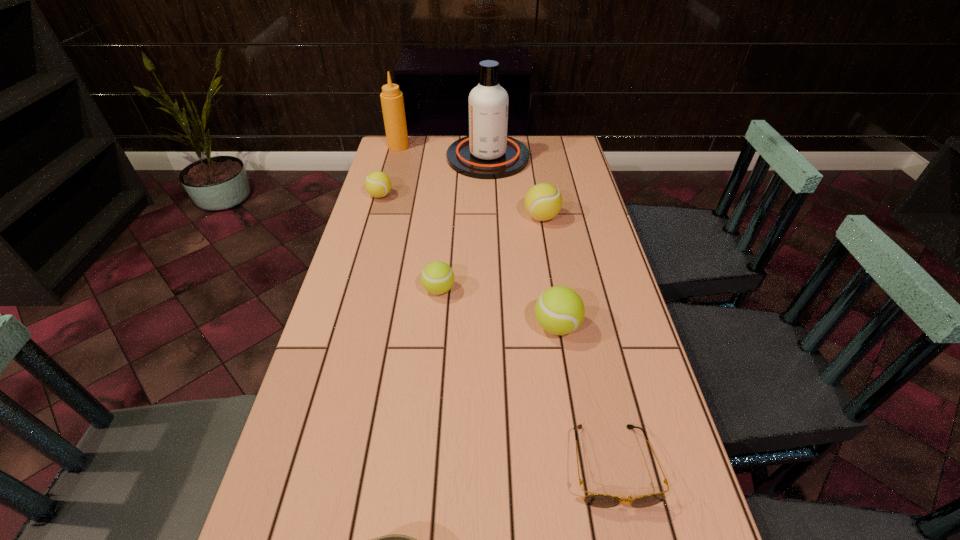
This screenshot has height=540, width=960. Identify the location of cleansing agent at the far edge. (487, 153).

At what (x,y) coordinates should I click in order to perform the action: click on condiment located at the far edge. Please return your answer as a coordinate pair (x, y). Looking at the image, I should click on (392, 102).

This screenshot has height=540, width=960. What are the coordinates of `condiment that is at the left edge` in the screenshot? It's located at (392, 102).

The image size is (960, 540). Identify the location of tennis ball present at the left edge. (378, 184).

Find the location of a particular element. This screenshot has height=540, width=960. sunglasses that is at the right edge is located at coordinates (596, 500).

I want to click on object that is at the far left corner, so click(x=392, y=102).

In the image, there is a desktop. Find the location of `vacant space at the far edge`. vacant space at the far edge is located at coordinates (446, 144).

I want to click on free space at the left edge of the desktop, so click(360, 484).

Locate an element on the screen. The width and height of the screenshot is (960, 540). vacant point at the right edge is located at coordinates (619, 531).

At what (x,y) coordinates should I click in order to perform the action: click on vacant area that lies between the white cleansing agent and the farthest tennis ball. Please return your answer as a coordinate pair (x, y). This screenshot has width=960, height=540. Looking at the image, I should click on (434, 177).